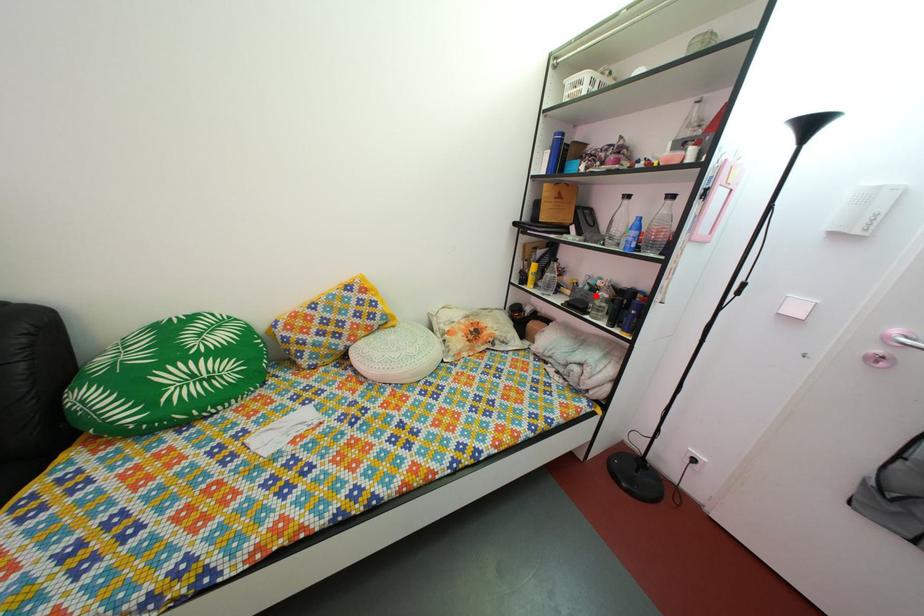
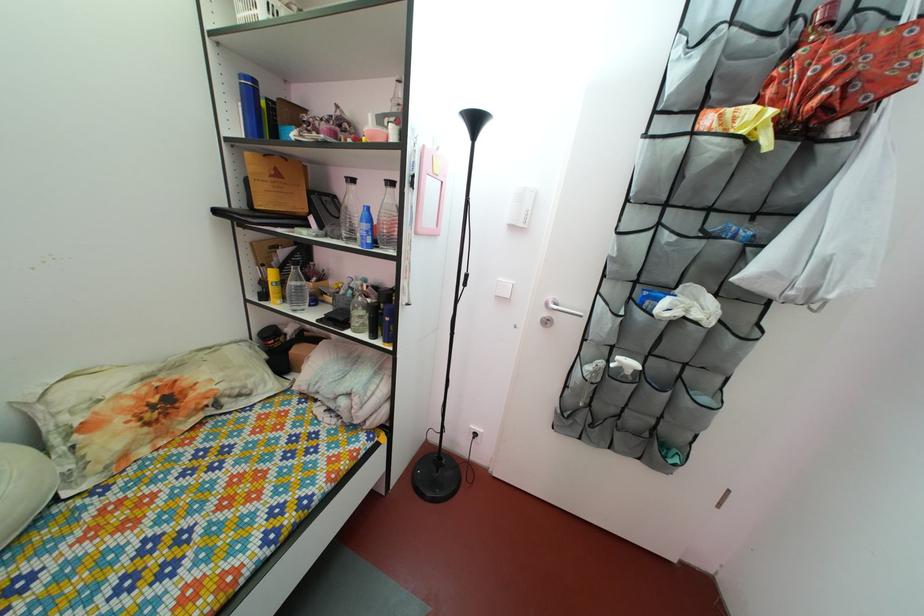
Find the pixel in the second image that matches the highlighted location in the first image.

(359, 301)